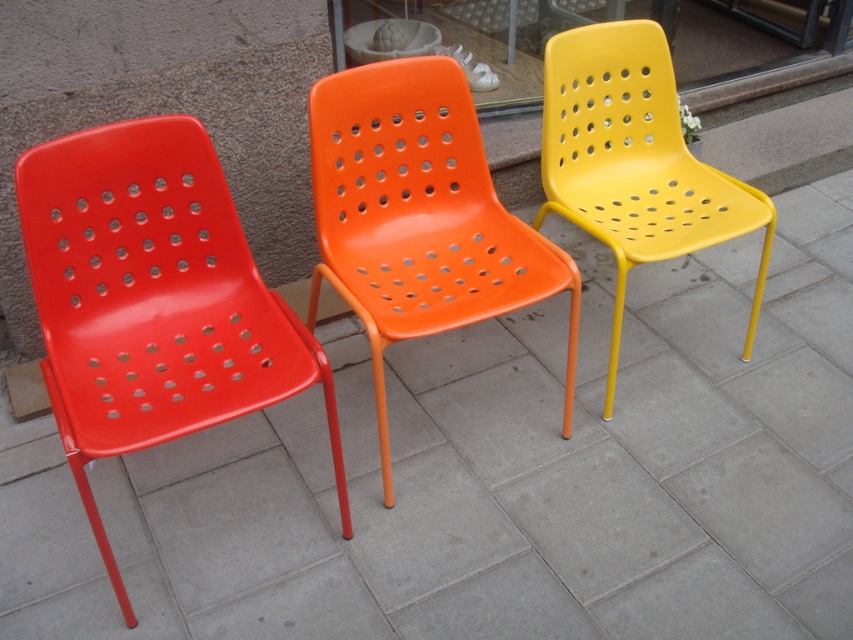
You are standing in a garden and want to place a small potted plant between you and the glossy plastic chairs at center. If the plant requires 3 feet of space to grow comfortably, will there be enough room?

The glossy plastic chairs at center are 4.73 feet away from you. Since the plant needs 3 feet of space, there is enough room to place it between you and the chairs.

You are standing at the origin point of the coordinate system where the pavement starts. You want to place a new chair exactly 0.5 meters to the right of the matte plastic chair at left. What is the coordinate of the new chair?

The matte plastic chair at left is located at coordinate point (152, 300). To place a new chair 0.5 meters to the right, add 0.5 to the x coordinate. The new coordinate would be (152, 620).